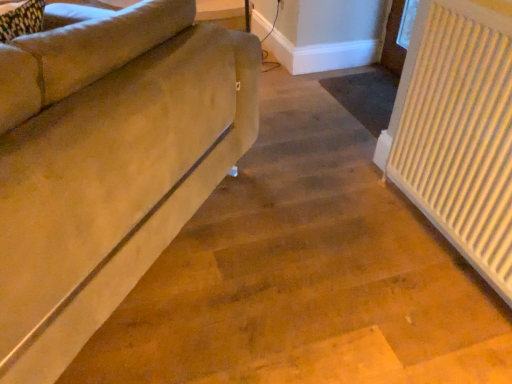
Question: Is white textured radiator at right bigger than suede-like beige couch at left?

Choices:
 (A) yes
 (B) no

Answer: (B)

Question: Can you confirm if white textured radiator at right is wider than suede-like beige couch at left?

Choices:
 (A) yes
 (B) no

Answer: (B)

Question: Is white textured radiator at right thinner than suede-like beige couch at left?

Choices:
 (A) no
 (B) yes

Answer: (B)

Question: From the image's perspective, is white textured radiator at right under suede-like beige couch at left?

Choices:
 (A) no
 (B) yes

Answer: (B)

Question: Is white textured radiator at right oriented towards suede-like beige couch at left?

Choices:
 (A) no
 (B) yes

Answer: (B)

Question: Considering the relative sizes of white textured radiator at right and suede-like beige couch at left in the image provided, is white textured radiator at right taller than suede-like beige couch at left?

Choices:
 (A) yes
 (B) no

Answer: (A)

Question: From a real-world perspective, is suede-like beige couch at left under white textured radiator at right?

Choices:
 (A) no
 (B) yes

Answer: (A)

Question: Is suede-like beige couch at left oriented towards white textured radiator at right?

Choices:
 (A) yes
 (B) no

Answer: (B)

Question: Is white textured radiator at right located within suede-like beige couch at left?

Choices:
 (A) no
 (B) yes

Answer: (A)

Question: Is suede-like beige couch at left thinner than white textured radiator at right?

Choices:
 (A) yes
 (B) no

Answer: (B)

Question: Is suede-like beige couch at left positioned before white textured radiator at right?

Choices:
 (A) no
 (B) yes

Answer: (B)

Question: Is suede-like beige couch at left looking in the opposite direction of white textured radiator at right?

Choices:
 (A) no
 (B) yes

Answer: (B)

Question: Would you say suede-like beige couch at left is to the left or to the right of white textured radiator at right in the picture?

Choices:
 (A) left
 (B) right

Answer: (A)